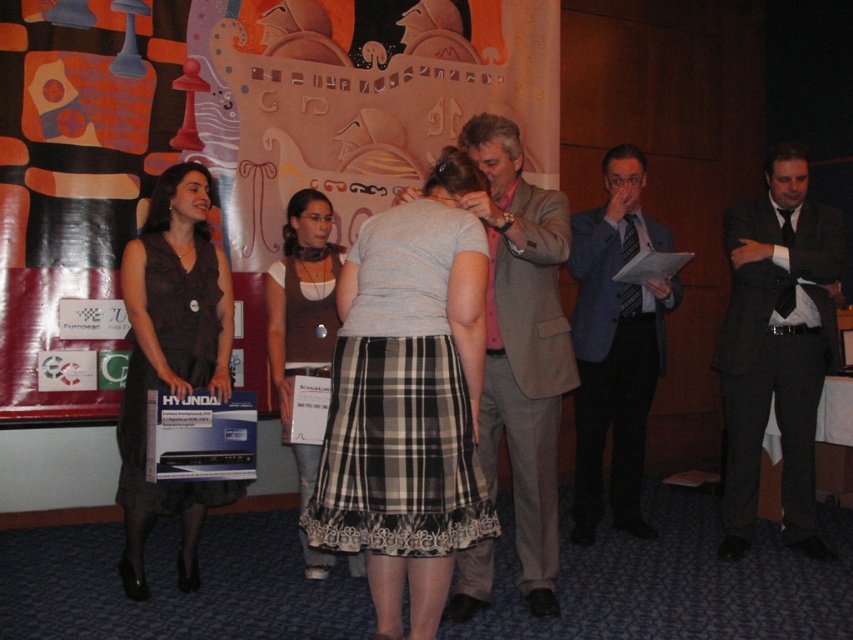
You are an event organizer who needs to place a new decorative item between the plastic box at center and the light brown textured suit at center. Based on their current positions, where should you place the new item to ensure it is centered between them?

The plastic box at center is positioned on the left side of the light brown textured suit at center, so placing the new item exactly between them would require positioning it to the right of the plastic box at center and to the left of the light brown textured suit at center, ensuring it is centered between both objects.

You are organizing a photo shoot and need to arrange two models wearing the dark gray suit at right and light brown textured suit at center. The director wants the smaller suit to be placed closer to the camera. Which model should stand closer to the camera?

The dark gray suit at right has a smaller size compared to the light brown textured suit at center, so the model wearing the dark gray suit at right should stand closer to the camera to fulfill the director requirement.

You are standing in the conference hall and need to locate the dark gray suit at right. According to the coordinates provided, where would you find it?

The dark gray suit at right is located at point (776,346).